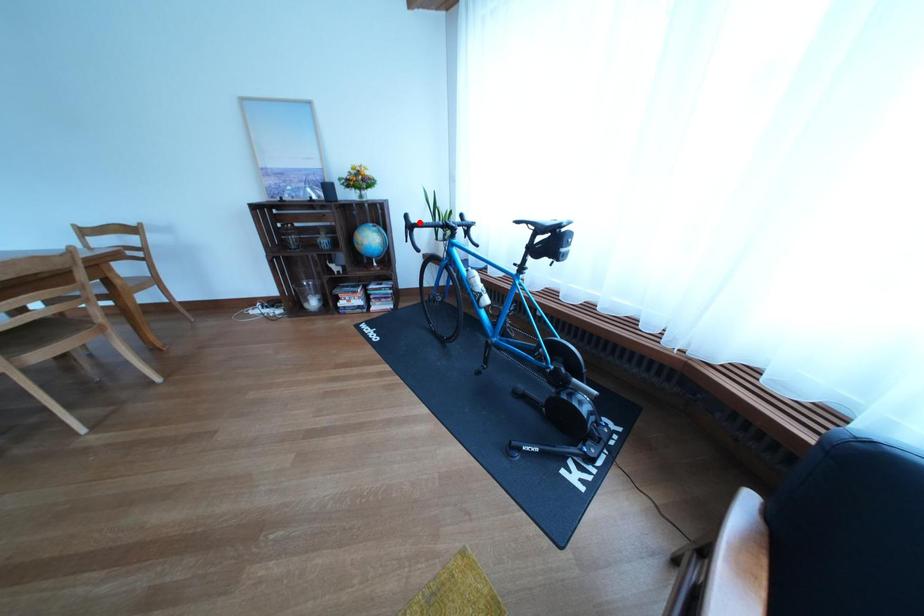
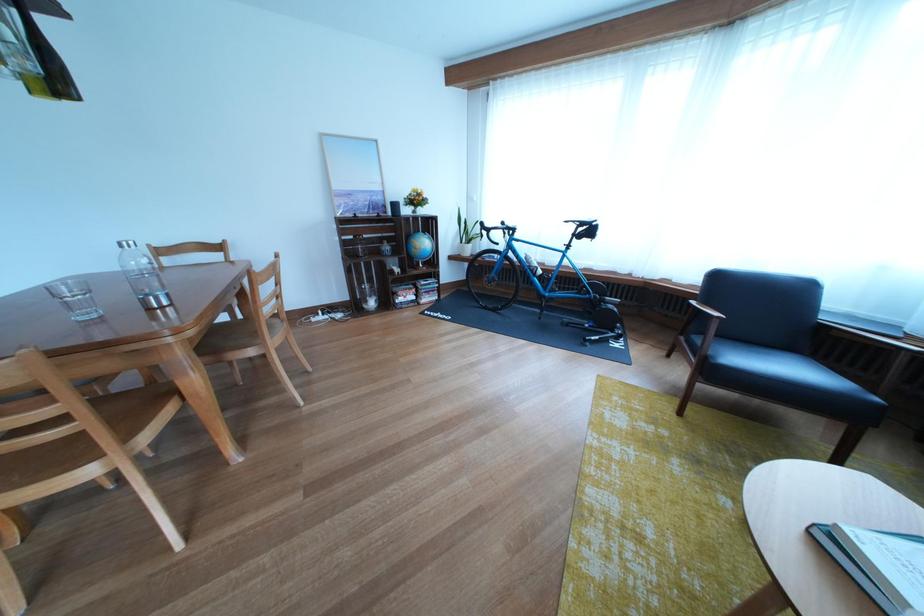
Question: I am providing you with two images of the same scene from different viewpoints. A red point is marked on the first image. Is the red point's position out of view in image 2?

Choices:
 (A) Yes
 (B) No

Answer: (A)